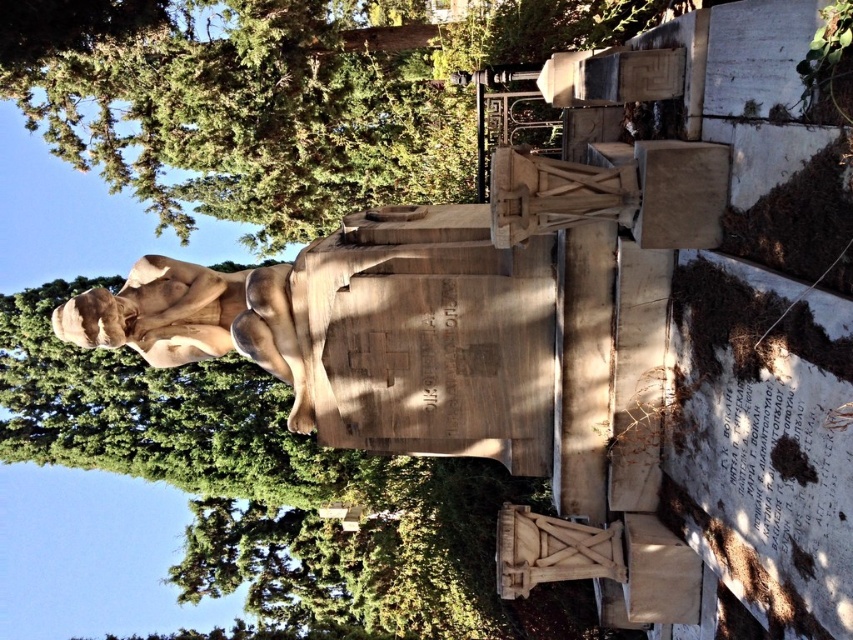
Which is below, green leafy tree at upper left or matte stone statue at center?

Positioned lower is matte stone statue at center.

Is point (428, 104) positioned after point (239, 321)?

Yes.

I want to click on green leafy tree at upper left, so click(239, 108).